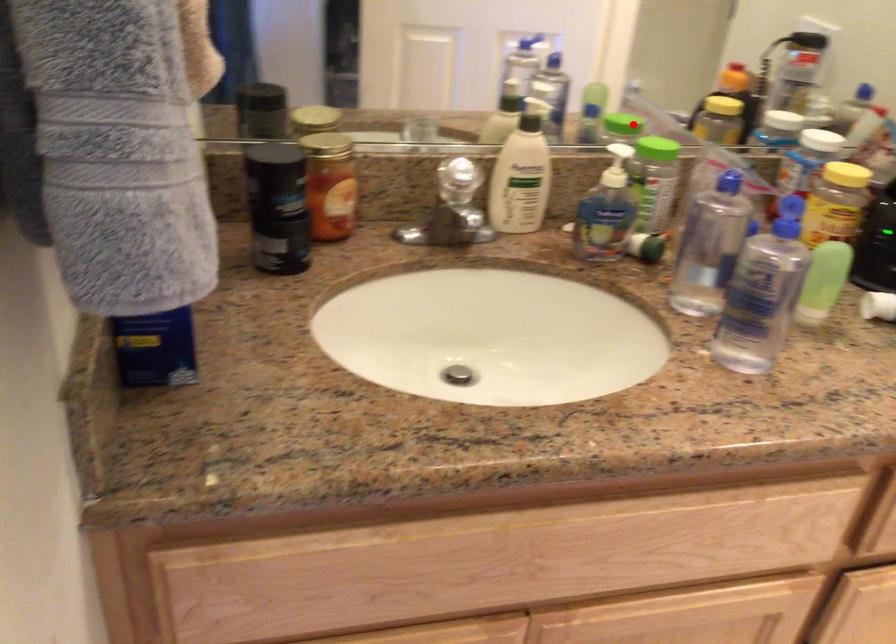
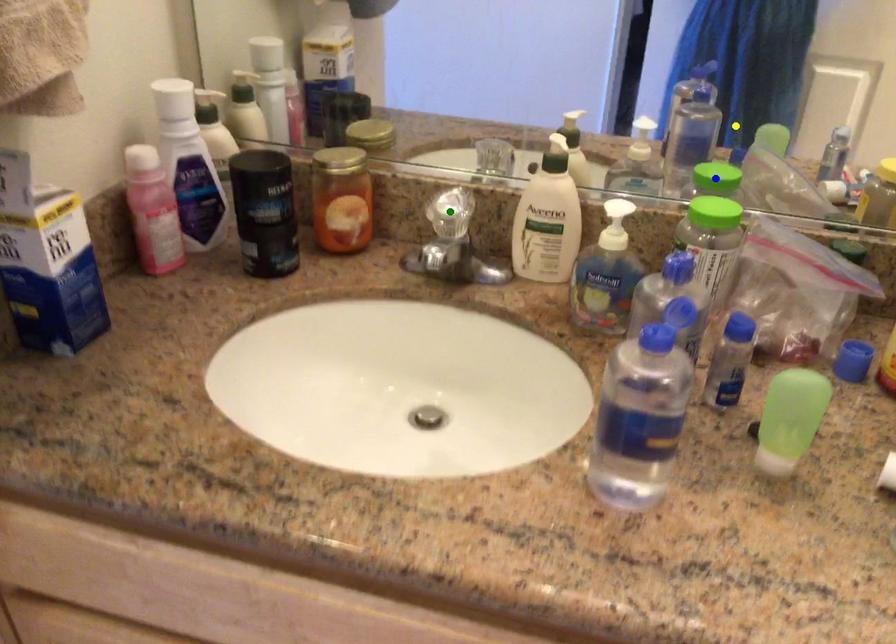
Question: I am providing you with two images of the same scene from different viewpoints. A red point is marked on the first image. You are given multiple points on the second image. Which point in image 2 represents the same 3d spot as the red point in image 1?

Choices:
 (A) yellow point
 (B) green point
 (C) blue point

Answer: (C)